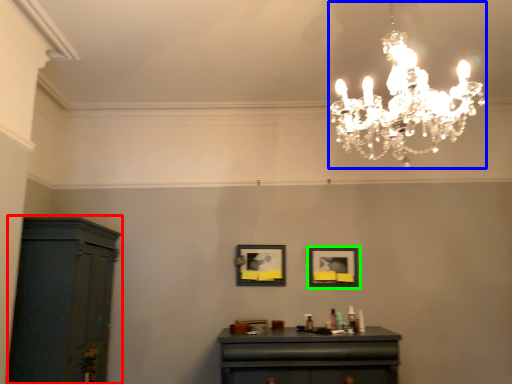
Question: Considering the real-world distances, which object is farthest from cabinetry (highlighted by a red box)? lamp (highlighted by a blue box) or picture frame (highlighted by a green box)?

Choices:
 (A) lamp
 (B) picture frame

Answer: (A)